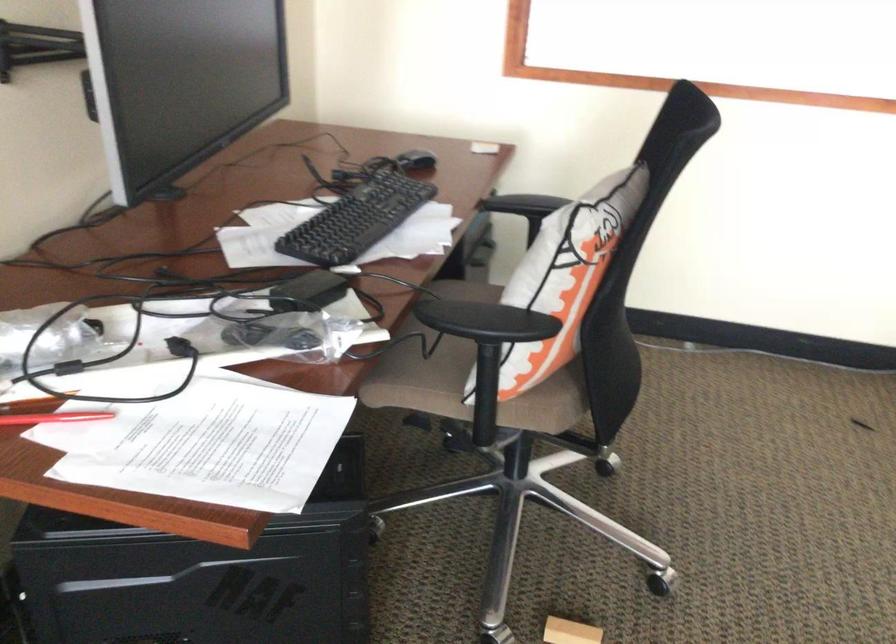
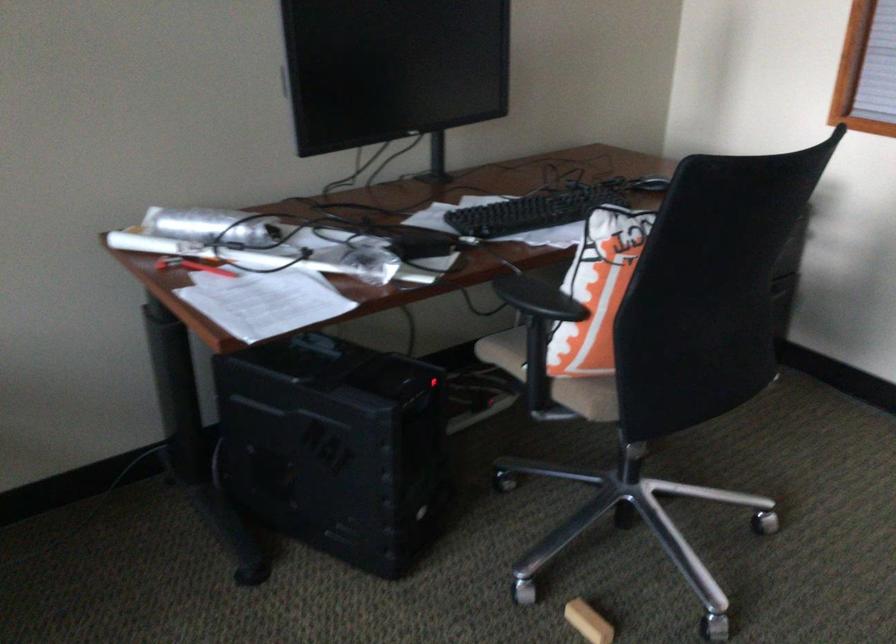
Question: I am providing you with two images of the same scene from different viewpoints. After the viewpoint changes to image2, which objects are now occluded?

Choices:
 (A) black computer mouse
 (B) small wooden block
 (C) rectangular bin slot
 (D) chair armrest

Answer: (D)